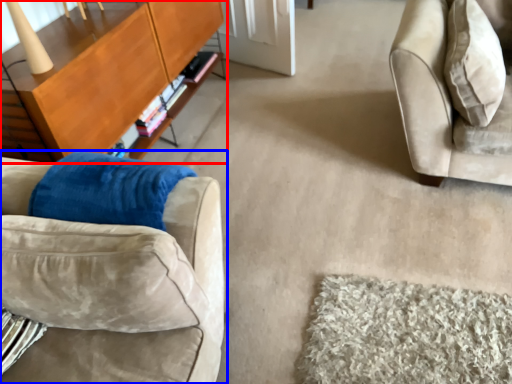
Question: Which of the following is the farthest to the observer, table (highlighted by a red box) or studio couch (highlighted by a blue box)?

Choices:
 (A) table
 (B) studio couch

Answer: (A)